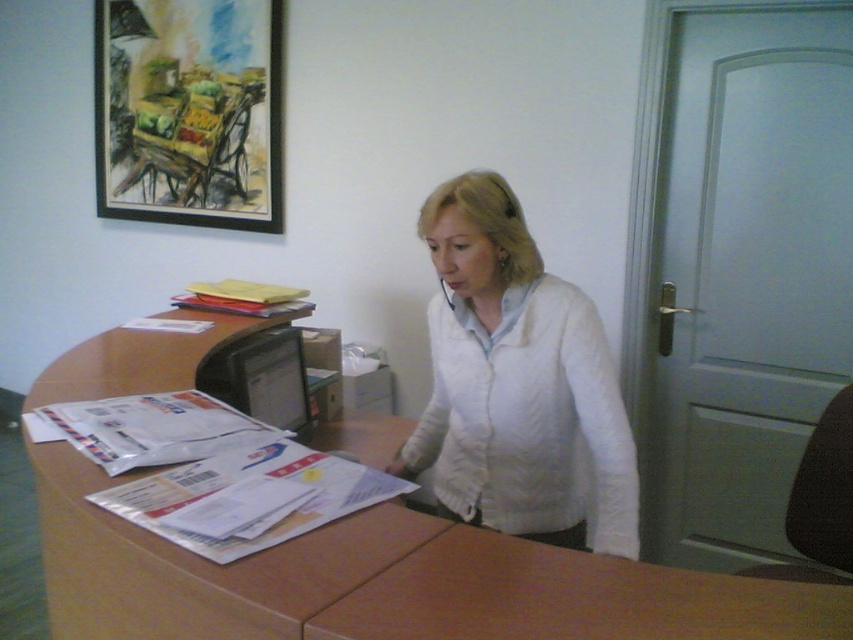
Question: Which of the following is the farthest from the observer?

Choices:
 (A) matte black monitor at center
 (B) brown wood table at center

Answer: (A)

Question: Does white matte shirt at center appear on the right side of watercolor paper painting at upper left?

Choices:
 (A) yes
 (B) no

Answer: (A)

Question: Which object appears closest to the camera in this image?

Choices:
 (A) brown wooden table at center
 (B) watercolor paper painting at upper left
 (C) matte black monitor at center
 (D) white matte shirt at center

Answer: (A)

Question: Among these objects, which one is nearest to the camera?

Choices:
 (A) matte black monitor at center
 (B) brown wood table at center
 (C) watercolor paper painting at upper left
 (D) brown wooden table at center

Answer: (D)

Question: Can you confirm if watercolor paper painting at upper left is smaller than matte black monitor at center?

Choices:
 (A) no
 (B) yes

Answer: (A)

Question: Is white matte shirt at center thinner than watercolor paper painting at upper left?

Choices:
 (A) yes
 (B) no

Answer: (A)